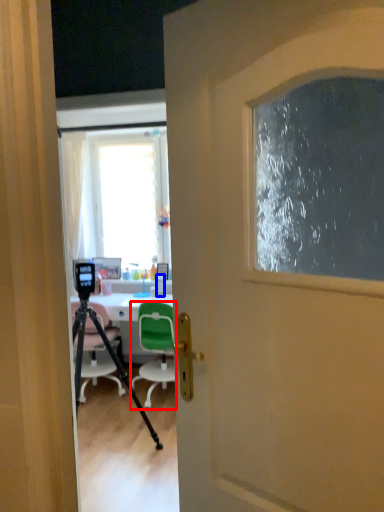
Question: Which object is further to the camera taking this photo, chair (highlighted by a red box) or bottle (highlighted by a blue box)?

Choices:
 (A) chair
 (B) bottle

Answer: (B)